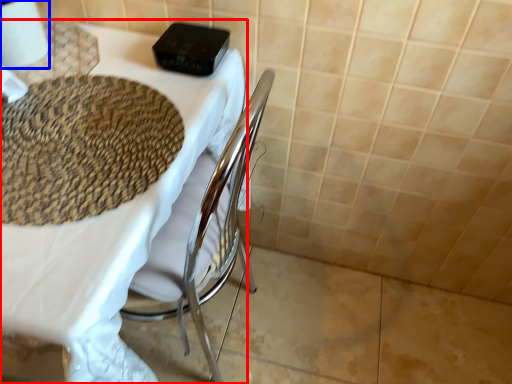
Question: Which point is closer to the camera, table (highlighted by a red box) or toilet paper (highlighted by a blue box)?

Choices:
 (A) table
 (B) toilet paper

Answer: (A)